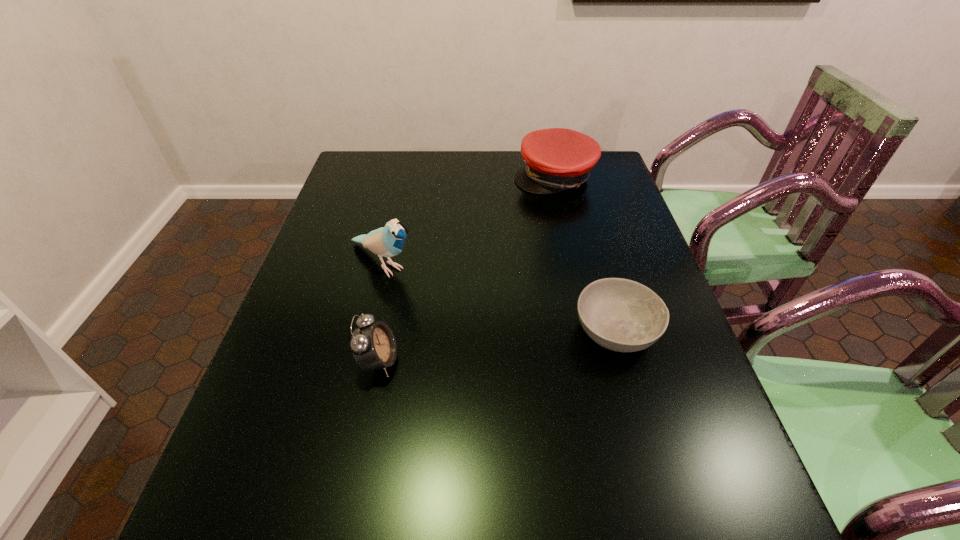
Identify the location of free space located at the face of the second farthest object. The height and width of the screenshot is (540, 960). (450, 312).

You are a GUI agent. You are given a task and a screenshot of the screen. Output one action in this format:
    pyautogui.click(x=<x>, y=<y>)
    Task: Click on the free location located at the face of the second farthest object
    This screenshot has width=960, height=540.
    Given the screenshot: What is the action you would take?
    pyautogui.click(x=497, y=346)

Find the location of a particular element. vacant space located 0.140m at the face of the second farthest object is located at coordinates (444, 307).

I want to click on object present at the far edge, so click(556, 159).

Find the location of a particular element. object located in the left edge section of the desktop is located at coordinates (388, 241).

Where is `bowl that is positioned at the right edge`? This screenshot has width=960, height=540. bowl that is positioned at the right edge is located at coordinates (622, 315).

Where is `cap that is positioned at the right edge`? cap that is positioned at the right edge is located at coordinates (556, 159).

The height and width of the screenshot is (540, 960). Identify the location of object located in the far right corner section of the desktop. (556, 159).

The height and width of the screenshot is (540, 960). Identify the location of vacant space at the far edge of the desktop. (485, 172).

In the image, there is a desktop. At what (x,y) coordinates should I click in order to perform the action: click on free region at the near edge. Please return your answer as a coordinate pair (x, y). This screenshot has width=960, height=540. Looking at the image, I should click on (529, 462).